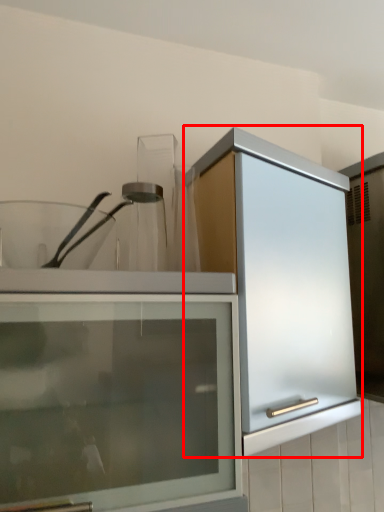
Question: From the image's perspective, what is the correct spatial relationship of cabinetry (annotated by the red box) in relation to glass jar?

Choices:
 (A) below
 (B) above

Answer: (A)